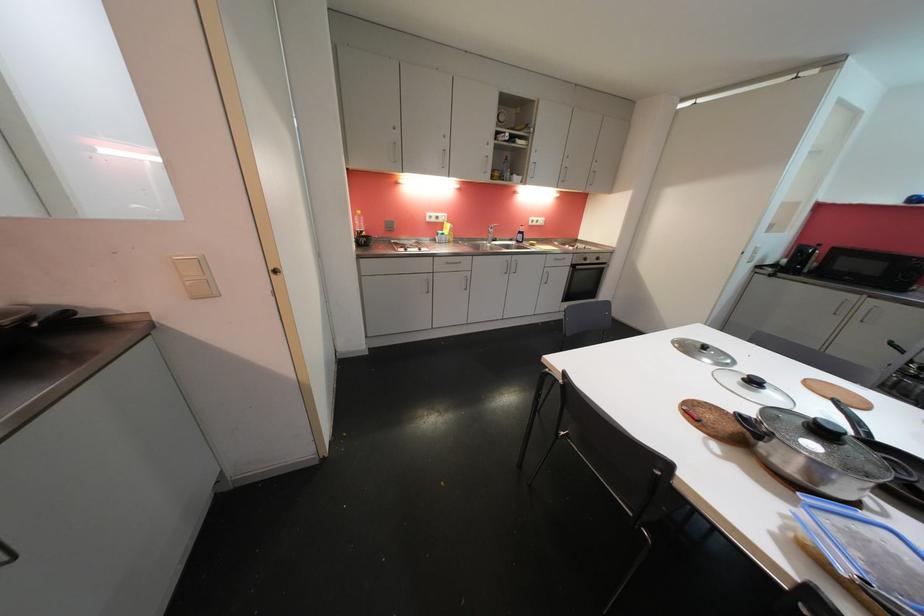
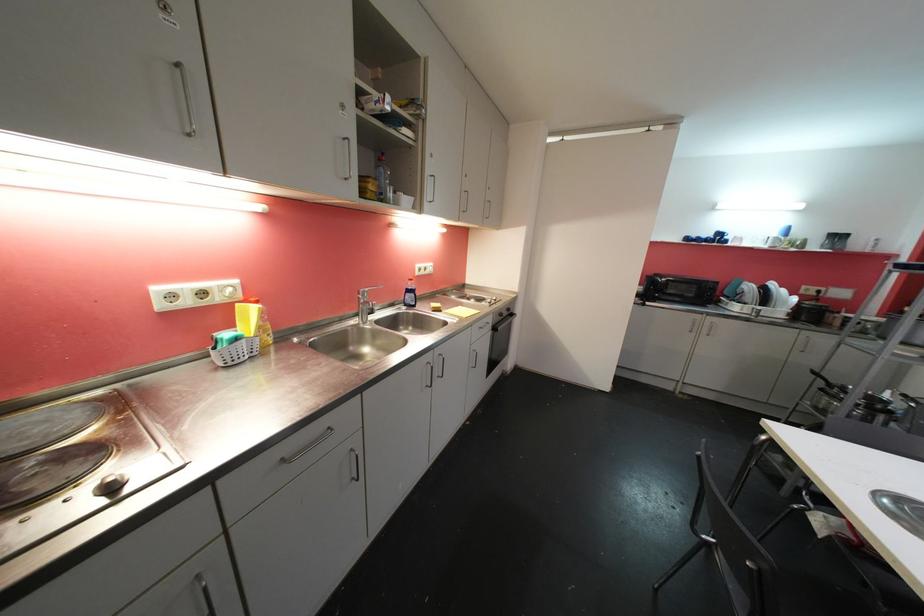
Find the pixel in the second image that matches point 525,235 in the first image.

(414, 293)